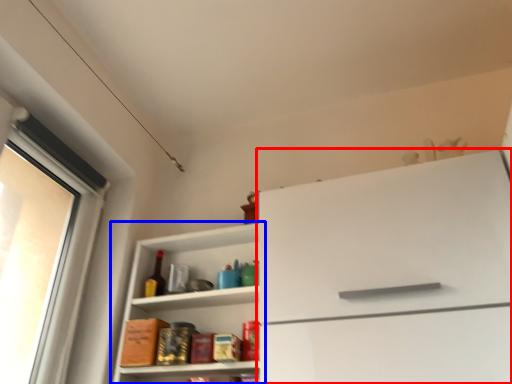
Question: Which object is further to the camera taking this photo, cabinetry (highlighted by a red box) or shelf (highlighted by a blue box)?

Choices:
 (A) cabinetry
 (B) shelf

Answer: (B)